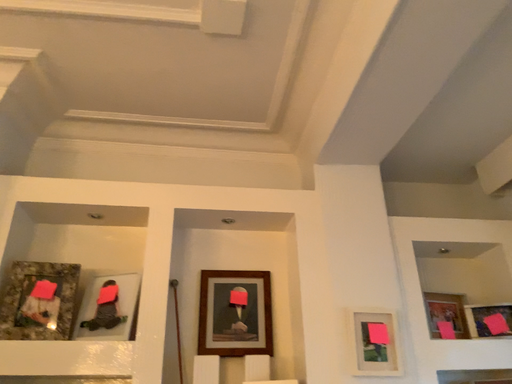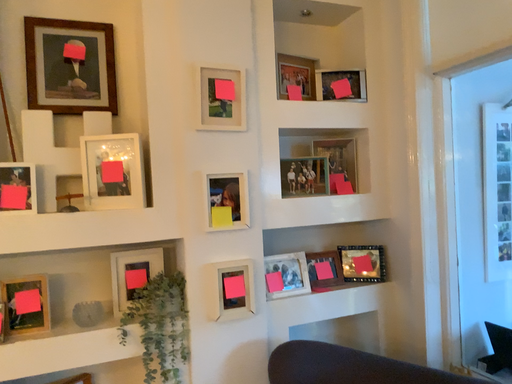
Question: Which way did the camera rotate in the video?

Choices:
 (A) rotated downward
 (B) rotated upward

Answer: (A)